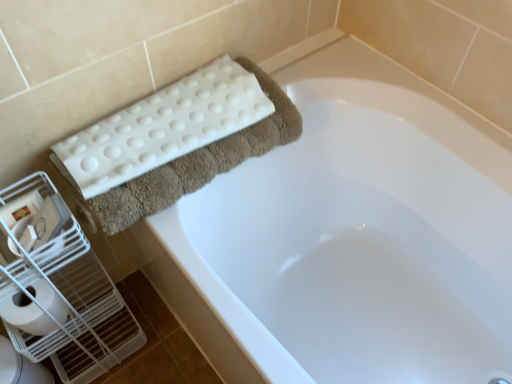
The image size is (512, 384). Find the location of `empty space that is ontop of white textured bath towel at upper left`. empty space that is ontop of white textured bath towel at upper left is located at coordinates (165, 115).